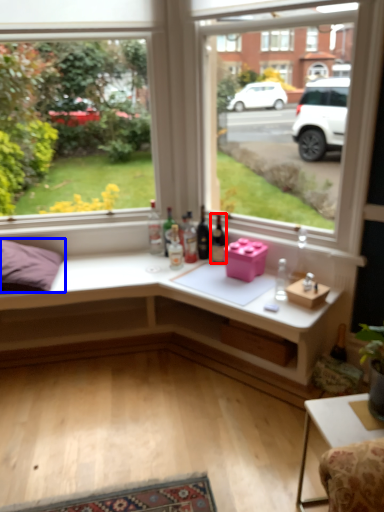
Question: Which of the following is the closest to the observer, bottle (highlighted by a red box) or pillow (highlighted by a blue box)?

Choices:
 (A) bottle
 (B) pillow

Answer: (B)